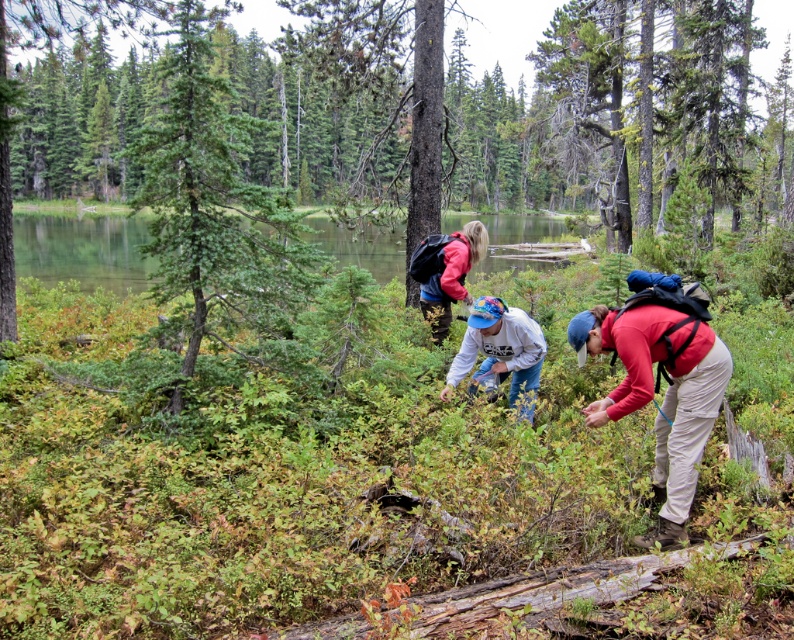
Question: Which object is closer to the camera taking this photo?

Choices:
 (A) white cotton shirt at center
 (B) matte pink jacket at center
 (C) green leafy water at center
 (D) red matte jacket at lower right

Answer: (D)

Question: Is green leafy water at center below matte pink jacket at center?

Choices:
 (A) no
 (B) yes

Answer: (A)

Question: Estimate the real-world distances between objects in this image. Which object is farther from the matte pink jacket at center?

Choices:
 (A) white cotton shirt at center
 (B) red matte jacket at lower right

Answer: (B)

Question: Is red matte jacket at lower right smaller than white cotton shirt at center?

Choices:
 (A) yes
 (B) no

Answer: (B)

Question: Which is nearer to the green leafy water at center?

Choices:
 (A) white cotton shirt at center
 (B) red matte jacket at lower right
 (C) matte pink jacket at center

Answer: (B)

Question: Does white cotton shirt at center have a smaller size compared to matte pink jacket at center?

Choices:
 (A) no
 (B) yes

Answer: (B)